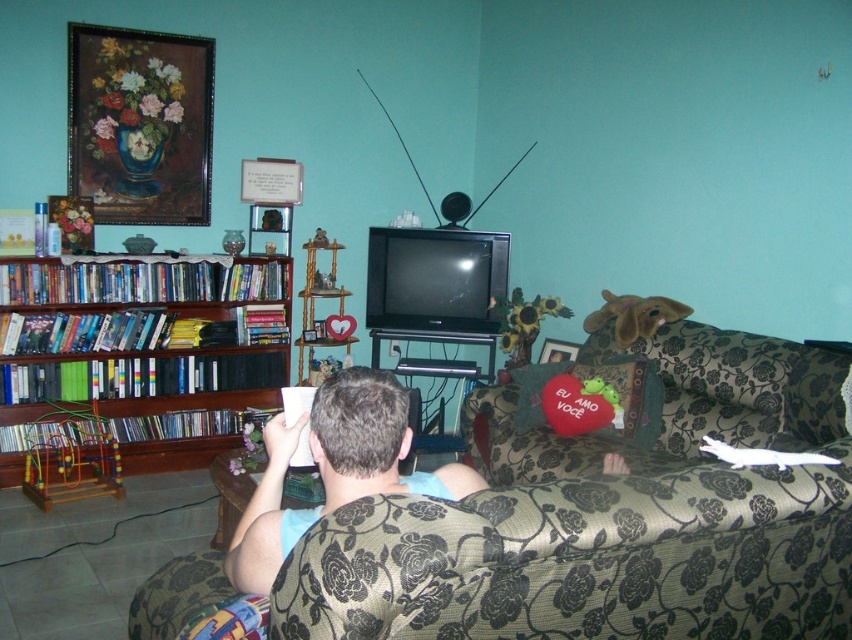
Question: Considering the relative positions of floral-patterned fabric couch at center and blue cotton shirt at center in the image provided, where is floral-patterned fabric couch at center located with respect to blue cotton shirt at center?

Choices:
 (A) above
 (B) below

Answer: (A)

Question: Is woodenmaterial/texturebookshelf at left to the left of blue cotton shirt at center from the viewer's perspective?

Choices:
 (A) no
 (B) yes

Answer: (B)

Question: Can you confirm if floral-patterned fabric couch at center is positioned to the left of blue cotton shirt at center?

Choices:
 (A) no
 (B) yes

Answer: (A)

Question: Which point is farther from the camera taking this photo?

Choices:
 (A) (137, 442)
 (B) (369, 492)
 (C) (418, 572)

Answer: (A)

Question: Based on their relative distances, which object is nearer to the woodenmaterial/texturebookshelf at left?

Choices:
 (A) floral-patterned fabric couch at center
 (B) blue cotton shirt at center

Answer: (A)

Question: Which is nearer to the floral-patterned fabric couch at center?

Choices:
 (A) blue cotton shirt at center
 (B) woodenmaterial/texturebookshelf at left

Answer: (A)